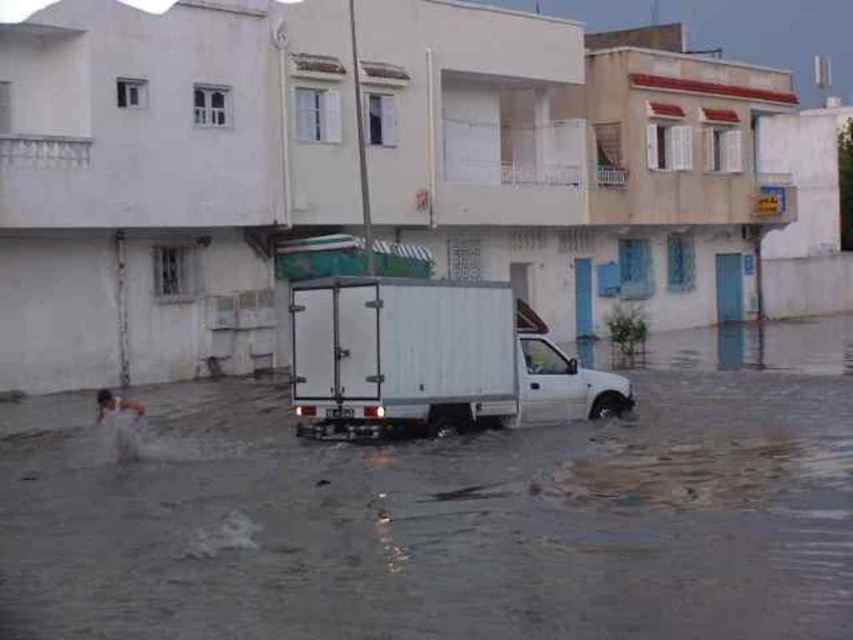
Question: Which is farther from the clear water at truck center?

Choices:
 (A) translucent wet surface at lower center
 (B) white matte truck at center

Answer: (B)

Question: Which point is farther to the camera?

Choices:
 (A) clear water at truck center
 (B) white matte truck at center

Answer: (B)

Question: Can you confirm if clear water at truck center is positioned to the right of white matte truck at center?

Choices:
 (A) yes
 (B) no

Answer: (B)

Question: Where is white matte truck at center located in relation to translucent wet surface at lower center in the image?

Choices:
 (A) above
 (B) below

Answer: (A)

Question: Observing the image, what is the correct spatial positioning of white matte truck at center in reference to translucent wet surface at lower center?

Choices:
 (A) below
 (B) above

Answer: (B)

Question: Which object appears closest to the camera in this image?

Choices:
 (A) clear water at truck center
 (B) translucent wet surface at lower center
 (C) white matte truck at center

Answer: (A)